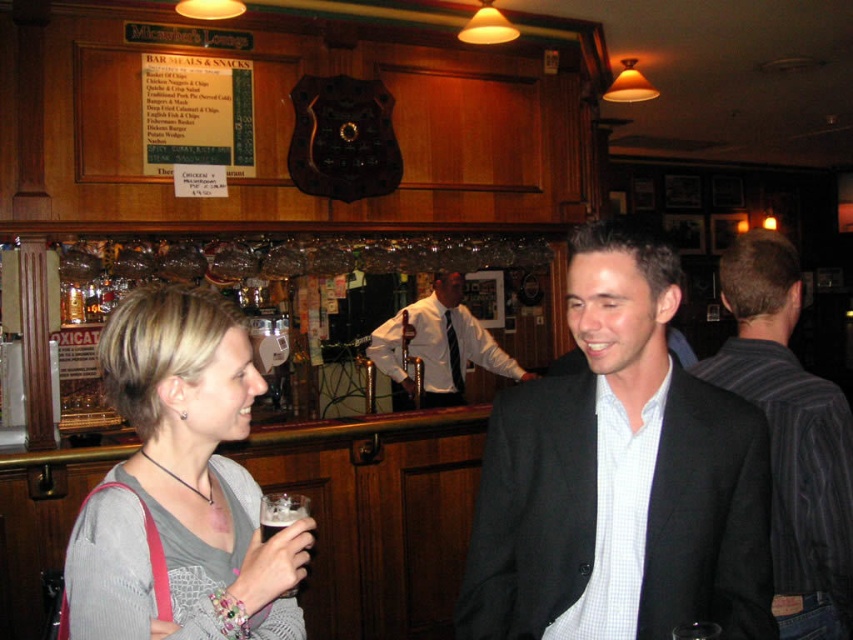
You are a bartender who needs to deliver a drink to the person wearing the gray sweater at center and the striped fabric shirt at right. Which customer should you approach first if you want to serve the one closer to the left side of the bar?

You should approach the gray sweater at center first because it is to the left of the striped fabric shirt at right, making it closer to the left side of the bar.

You are a bartender who needs to deliver a drink to the customer wearing the gray knit sweater at center. The brown frothy beer at lower left is currently on the counter. Which direction should you move the beer to reach the customer?

The gray knit sweater at center is to the right of the brown frothy beer at lower left, so you should move the beer to the right to reach the customer.